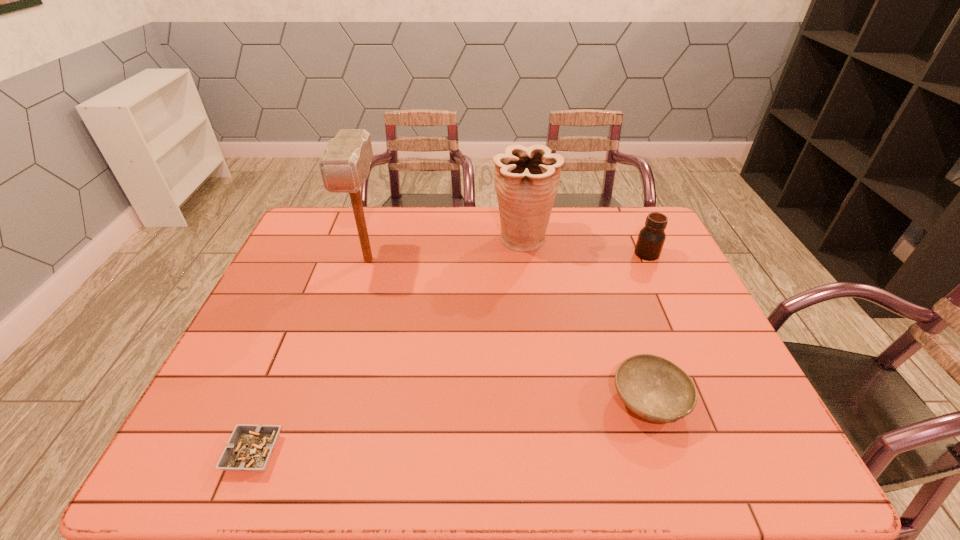
Locate an element on the screen. free spot located 0.220m on the striking face of the fourth object from right to left is located at coordinates (346, 336).

You are a GUI agent. You are given a task and a screenshot of the screen. Output one action in this format:
    pyautogui.click(x=<x>, y=<y>)
    Task: Click on the vacant space situated 0.190m on the left of the third object from left to right
    The height and width of the screenshot is (540, 960).
    Given the screenshot: What is the action you would take?
    [434, 240]

Identify the location of free location located on the left of the jar. (619, 254).

Locate an element on the screen. free space located on the left of the bowl is located at coordinates (549, 401).

You are a GUI agent. You are given a task and a screenshot of the screen. Output one action in this format:
    pyautogui.click(x=<x>, y=<y>)
    Task: Click on the blank space located on the back of the shortest object
    
    Given the screenshot: What is the action you would take?
    pyautogui.click(x=278, y=392)

This screenshot has height=540, width=960. In order to click on mallet at the far edge in this screenshot , I will do `click(345, 165)`.

Locate an element on the screen. This screenshot has height=540, width=960. urn that is at the far edge is located at coordinates (526, 181).

Where is `jar situated at the far edge`? jar situated at the far edge is located at coordinates (651, 238).

Locate an element on the screen. bowl present at the near edge is located at coordinates (654, 388).

This screenshot has width=960, height=540. In order to click on ashtray that is at the near edge in this screenshot , I will do `click(250, 447)`.